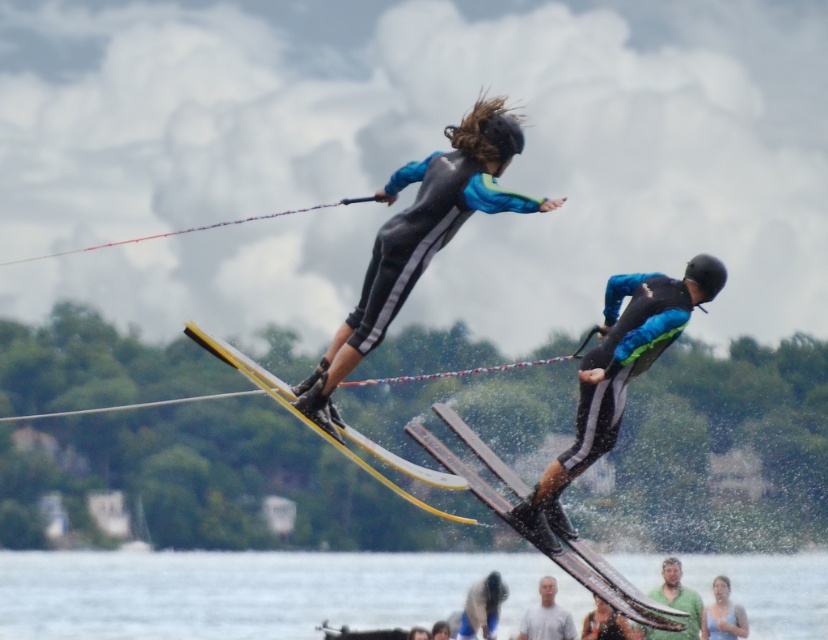
In the image of two water skiers performing a trick, there is a point marked at coordinates (614, 588). What object is located at this point?

The point at coordinates (614, 588) marks the location of the metallic silver skis at center.

You are a photographer trying to capture the perfect shot of the matte black ski at center and the gray matte shirt at lower center. Since you want both objects to appear equally prominent in the photo, which object should you zoom in on more?

The matte black ski at center is larger than the gray matte shirt at lower center, so you should zoom in more on the gray matte shirt at lower center to make both appear equally prominent in the photo.